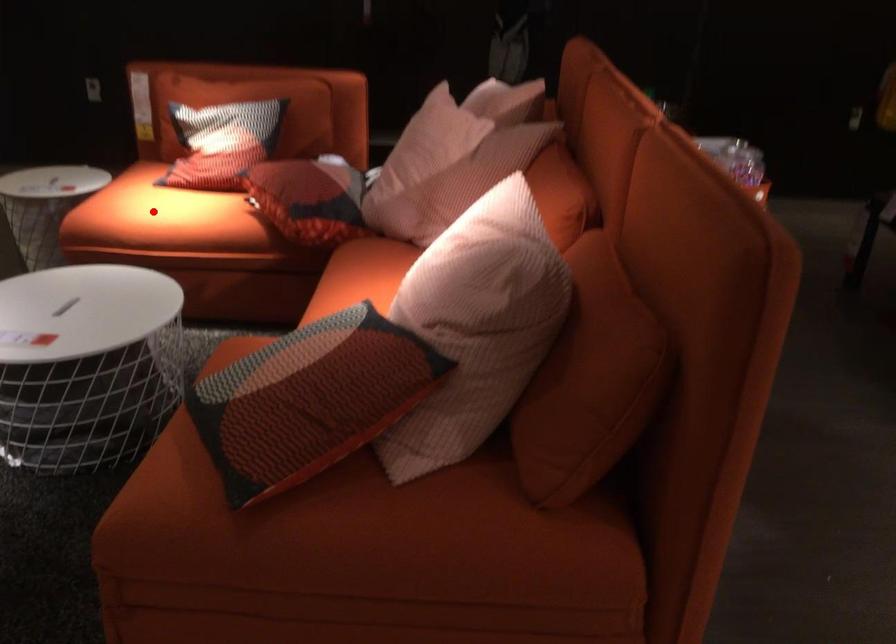
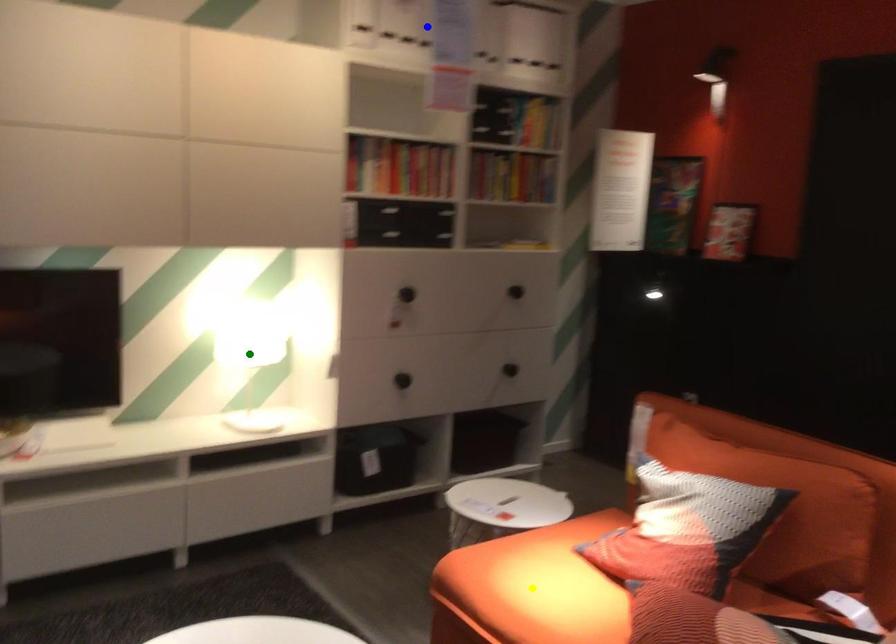
Question: I am providing you with two images of the same scene from different viewpoints. A red point is marked on the first image. You are given multiple points on the second image. Which spot in image 2 lines up with the point in image 1?

Choices:
 (A) yellow point
 (B) blue point
 (C) green point

Answer: (A)